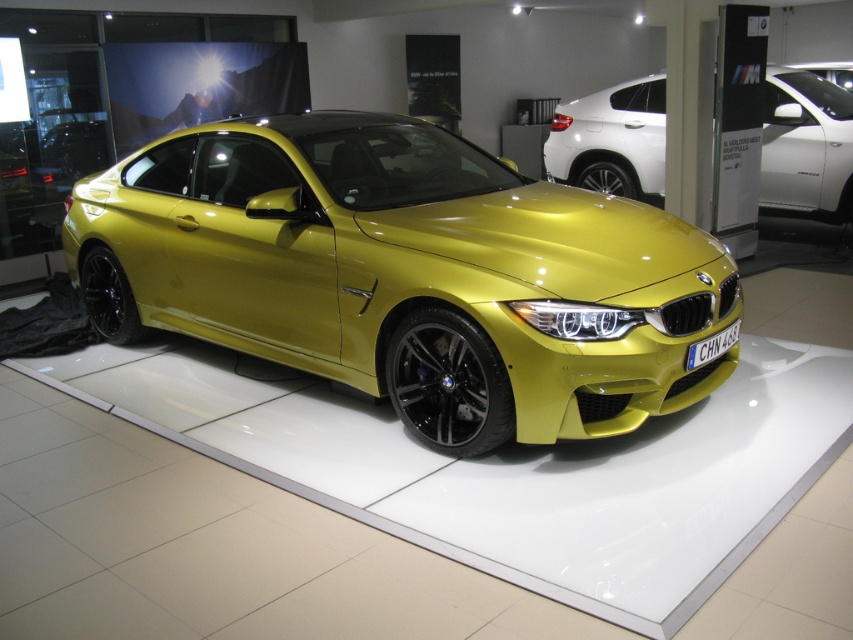
You are a photographer planning to capture the metallic yellow car at center and the metallic yellow car at upper right in a single frame. Considering their sizes, which car should you focus on to ensure both are visible without cropping?

The metallic yellow car at center is taller than the metallic yellow car at upper right, so focusing on the metallic yellow car at center will allow both cars to be visible without cropping since it is larger and can be positioned appropriately in the frame.

You are a delivery person who needs to park a 4.5 meter long truck in the showroom. There is a metallic yellow car at center and a metallic yellow car at upper right. Can you park the truck between them without hitting either car?

The metallic yellow car at center and metallic yellow car at upper right are 4.50 meters apart. Since the truck is exactly 4.5 meters long, it can be parked between them without hitting either car as the distance matches the truck length.

You are standing in front of the BMW car in the showroom. There are two points marked on the car, one at coordinate point (491, 252) and another at point (651, 125). If you were to reach out to touch these points, which one would require you to stretch your arm less?

Point (491, 252) is closer to the camera than point (651, 125), so you would need to stretch your arm less to touch point (491, 252).